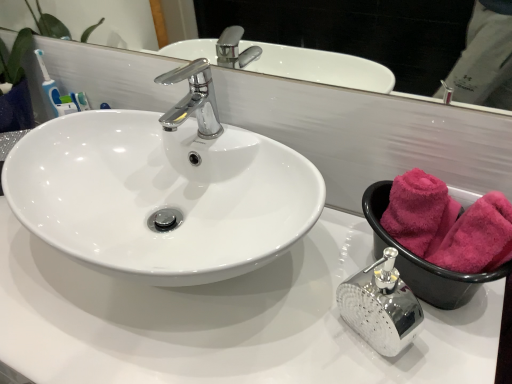
Image resolution: width=512 pixels, height=384 pixels. I want to click on free space to the left of pink soft towel at right, so click(311, 294).